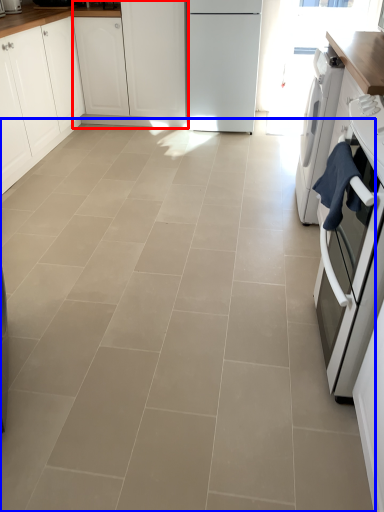
Question: Among these objects, which one is farthest to the camera, cabinetry (highlighted by a red box) or ceramic tile (highlighted by a blue box)?

Choices:
 (A) cabinetry
 (B) ceramic tile

Answer: (A)